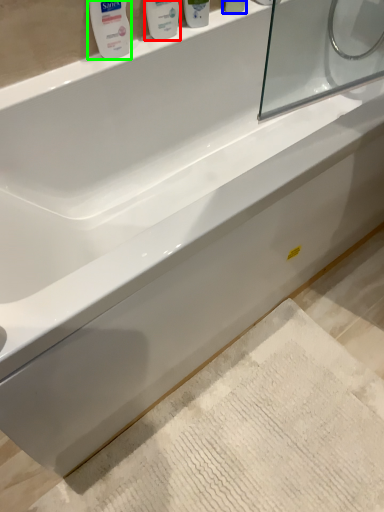
Question: Which is nearer to the mouthwash (highlighted by a red box)? mouthwash (highlighted by a blue box) or mouthwash (highlighted by a green box).

Choices:
 (A) mouthwash
 (B) mouthwash

Answer: (B)